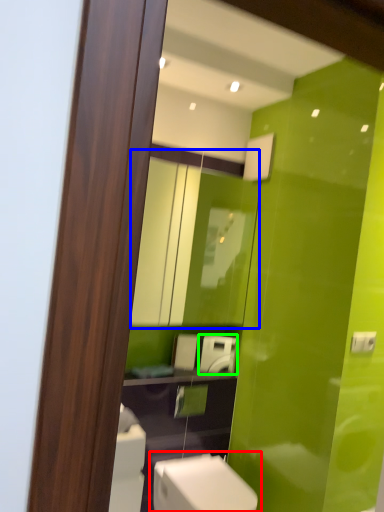
Question: Which object is the closest to the toilet (highlighted by a red box)? Choose among these: mirror (highlighted by a blue box) or appliance (highlighted by a green box).

Choices:
 (A) mirror
 (B) appliance

Answer: (B)